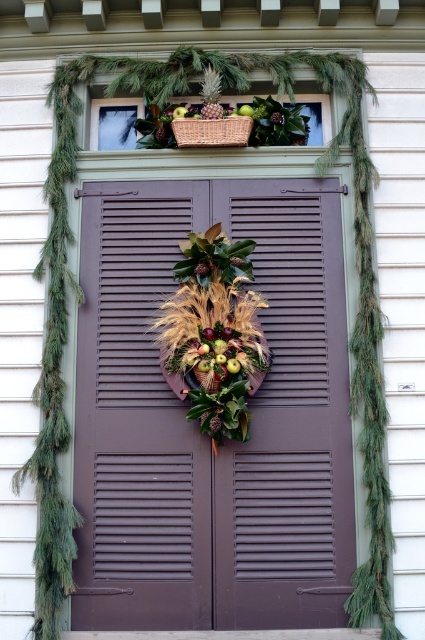
Who is positioned more to the left, brown matte door at center or green matte wreath at center?

brown matte door at center

Does brown matte door at center come behind green matte wreath at center?

That is False.

Which is behind, point (223, 449) or point (272, 120)?

The point (272, 120) is more distant.

Where is `brown matte door at center`? This screenshot has width=425, height=640. brown matte door at center is located at coordinates (195, 422).

Can you confirm if woven brown basket at upper center is taller than brushed metal pineapple at upper center?

Yes, woven brown basket at upper center is taller than brushed metal pineapple at upper center.

Is woven brown basket at upper center wider than brushed metal pineapple at upper center?

Correct, the width of woven brown basket at upper center exceeds that of brushed metal pineapple at upper center.

Which is behind, point (235, 145) or point (209, 109)?

The point (235, 145) is more distant.

At what (x,y) coordinates should I click in order to perform the action: click on woven brown basket at upper center. Please return your answer as a coordinate pair (x, y). Image resolution: width=425 pixels, height=640 pixels. Looking at the image, I should click on (212, 131).

Is brown matte door at center positioned at the back of wooden woven basket at center?

Yes, it is behind wooden woven basket at center.

The width and height of the screenshot is (425, 640). Find the location of `brown matte door at center`. brown matte door at center is located at coordinates click(195, 422).

Locate an element on the screen. This screenshot has width=425, height=640. brown matte door at center is located at coordinates (195, 422).

This screenshot has height=640, width=425. Find the location of `brown matte door at center`. brown matte door at center is located at coordinates (195, 422).